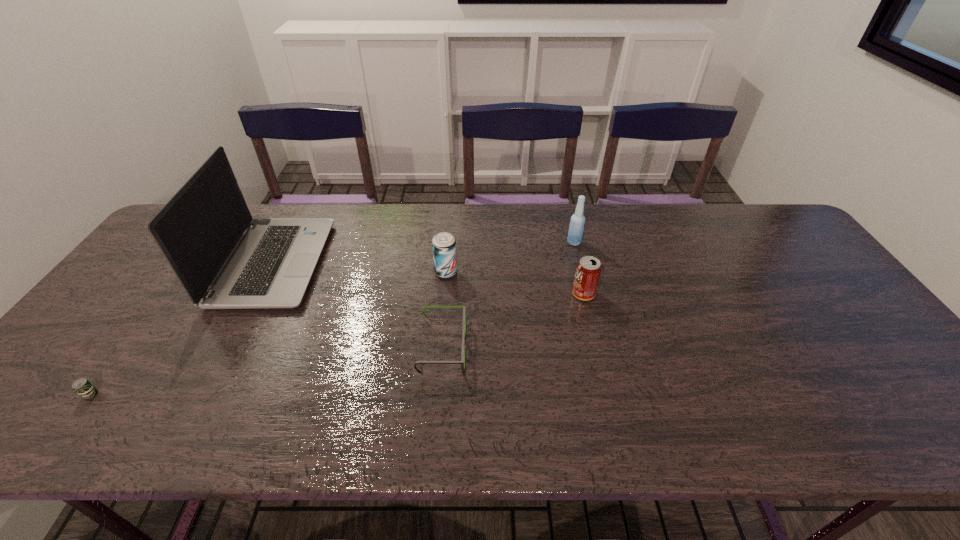
The width and height of the screenshot is (960, 540). I want to click on unoccupied position between the fifth tallest object and the fifth object from right to left, so click(x=358, y=306).

You are a GUI agent. You are given a task and a screenshot of the screen. Output one action in this format:
    pyautogui.click(x=<x>, y=<y>)
    Task: Click on the unoccupied area between the fifth farthest object and the tallest object
    
    Given the screenshot: What is the action you would take?
    pyautogui.click(x=358, y=306)

Where is `empty space between the soda can and the nearer beer can`? Image resolution: width=960 pixels, height=540 pixels. empty space between the soda can and the nearer beer can is located at coordinates (337, 345).

Identify the location of free space between the laptop computer and the right beer can. The width and height of the screenshot is (960, 540). (360, 267).

The image size is (960, 540). I want to click on object that is the third closest to the soda can, so click(443, 244).

Identify which object is the second nearest to the soda can. Please provide its 2D coordinates. Your answer should be formatted as a tuple, i.e. [(x, y)], where the tuple contains the x and y coordinates of a point satisfying the conditions above.

[(462, 362)]

You are a GUI agent. You are given a task and a screenshot of the screen. Output one action in this format:
    pyautogui.click(x=<x>, y=<y>)
    Task: Click on the vacant space that satisfies the following two spatial constraints: 1. on the screen of the second object from left to right; 2. on the left side of the farther beer can
    
    Given the screenshot: What is the action you would take?
    pyautogui.click(x=270, y=272)

The height and width of the screenshot is (540, 960). In order to click on free space that satisfies the following two spatial constraints: 1. on the front side of the farther beer can; 2. on the right side of the soda can in this screenshot , I will do `click(444, 294)`.